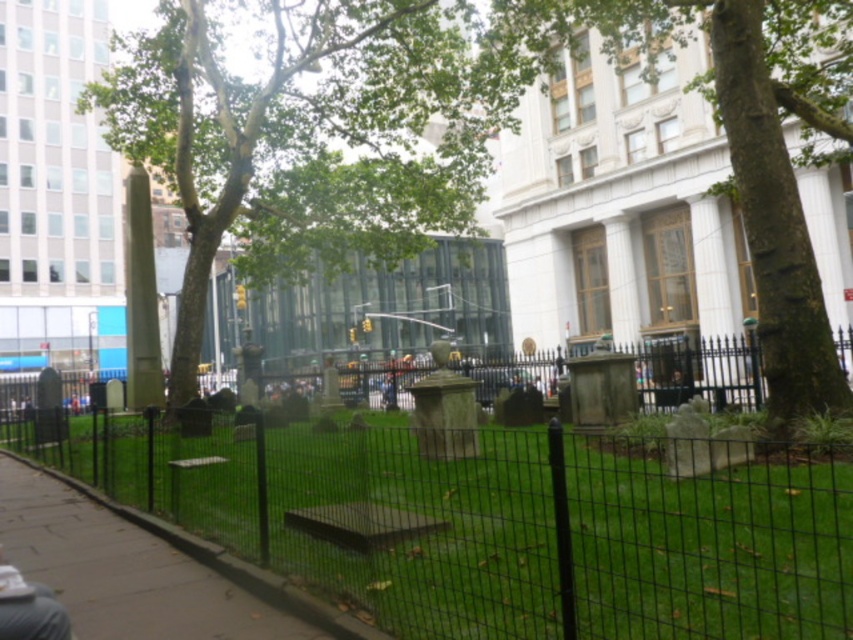
Question: Is green textured bark at center below green leafy tree at center?

Choices:
 (A) yes
 (B) no

Answer: (A)

Question: Which object is farther from the camera taking this photo?

Choices:
 (A) smooth concrete pavement at lower left
 (B) green textured bark at center
 (C) green grass at center

Answer: (B)

Question: Which of these objects is positioned closest to the green grass at center?

Choices:
 (A) green leafy tree at center
 (B) green textured bark at center

Answer: (B)

Question: Which object is positioned farthest from the green grass at center?

Choices:
 (A) green textured bark at center
 (B) smooth concrete pavement at lower left
 (C) green leafy tree at center

Answer: (C)

Question: Does green leafy tree at center have a greater width compared to smooth concrete pavement at lower left?

Choices:
 (A) no
 (B) yes

Answer: (B)

Question: Does green grass at center appear on the right side of green leafy tree at center?

Choices:
 (A) yes
 (B) no

Answer: (A)